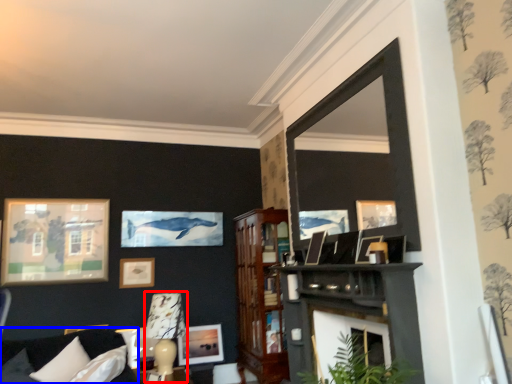
Question: Among these objects, which one is farthest to the camera, lamp (highlighted by a red box) or couch (highlighted by a blue box)?

Choices:
 (A) lamp
 (B) couch

Answer: (A)